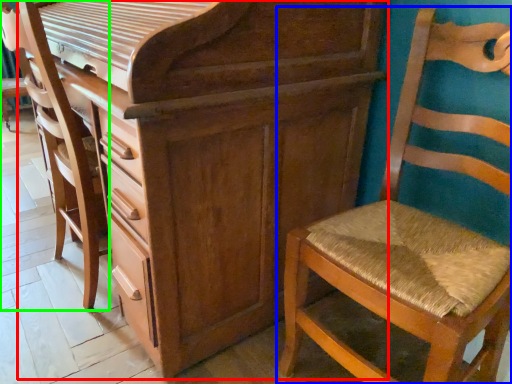
Question: Which object is the closest to the chest of drawers (highlighted by a red box)? Choose among these: chair (highlighted by a blue box) or swivel chair (highlighted by a green box).

Choices:
 (A) chair
 (B) swivel chair

Answer: (A)